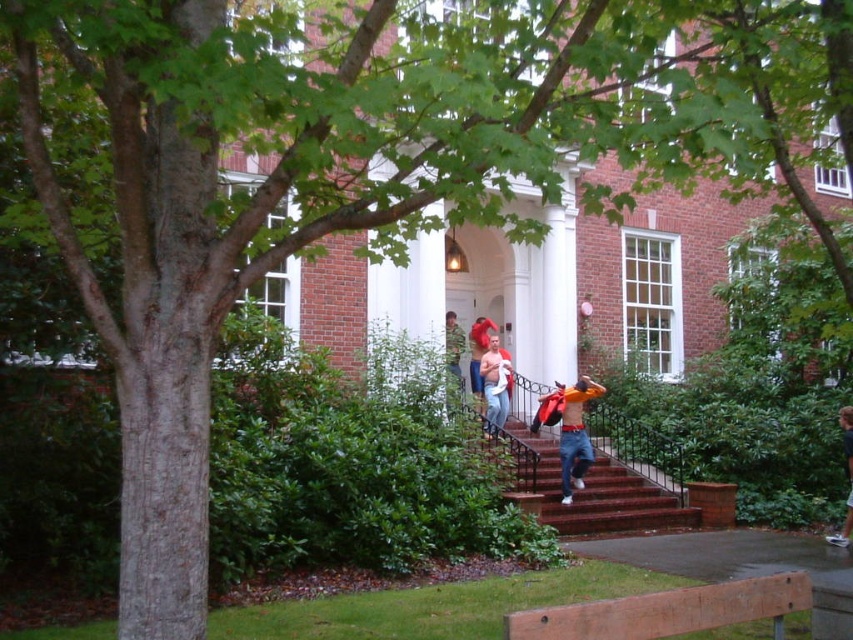
You are a photographer trying to capture a group photo of the light blue jeans at center and the matte orange shirt at center. Since you want to ensure both subjects are fully visible, which person should you position closer to the front?

You should position the matte orange shirt at center closer to the front because the light blue jeans at center is taller than matte orange shirt at center.

You are a photographer trying to capture both the denim jeans at center and the light blue jeans at center in a single frame. Since you want both to be clearly visible, which pair of jeans should you focus on to ensure the smaller one is in focus?

The light blue jeans at center is smaller in size than the denim jeans at center, so you should focus on the light blue jeans at center to ensure the smaller one is in focus.

Consider the image. You are a photographer trying to capture both the denim jeans at center and the matte orange shirt at center in the same frame. Which object should you focus on first to ensure both are in the frame?

You should focus on the denim jeans at center first since it is larger in size compared to the matte orange shirt at center, ensuring it fits within the frame before adjusting for the smaller object.